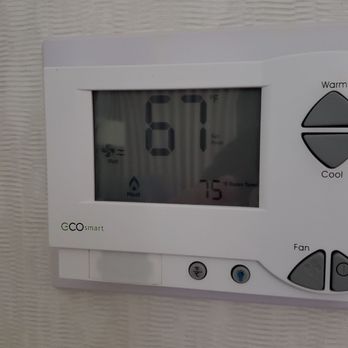
At what (x,y) coordinates should I click in order to perform the action: click on grey control buttons. Please return your answer as a coordinate pair (x, y). Looking at the image, I should click on (308, 270), (339, 277), (327, 156), (330, 116).